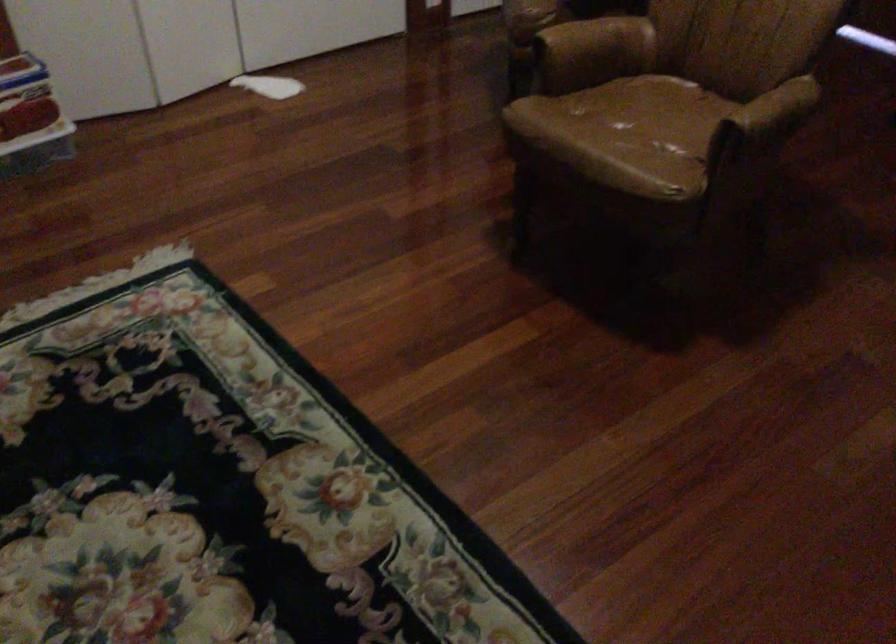
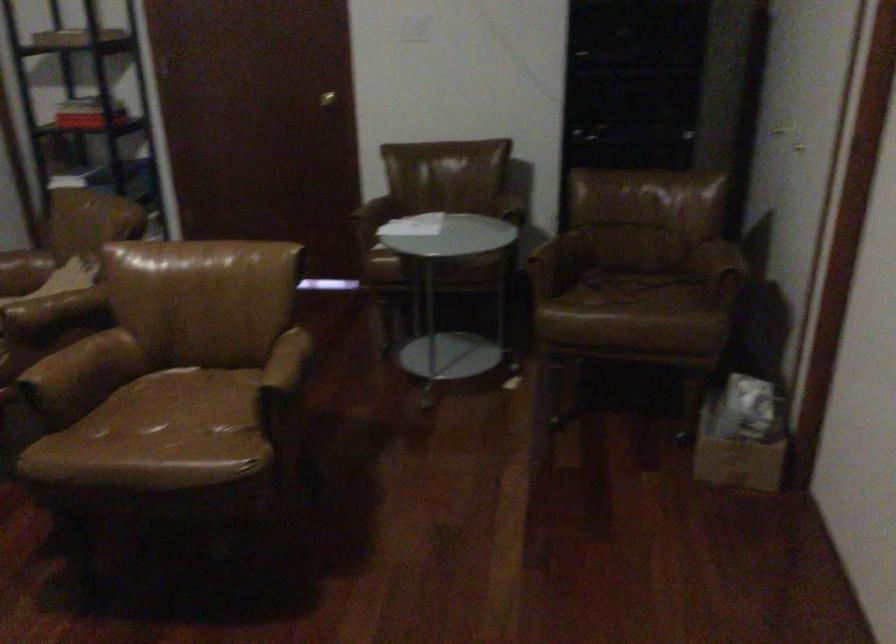
The point at [755,116] is marked in the first image. Where is the corresponding point in the second image?

(283, 371)